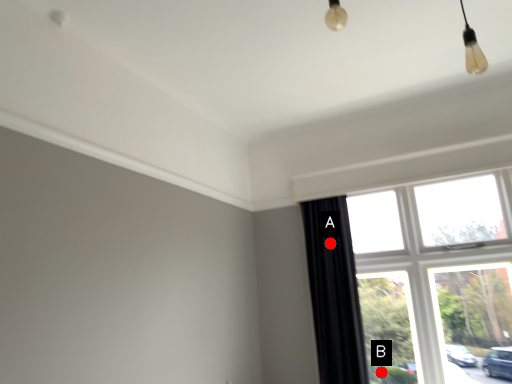
Question: Two points are circled on the image, labeled by A and B beside each circle. Which point is farther from the camera taking this photo?

Choices:
 (A) A is further
 (B) B is further

Answer: (A)